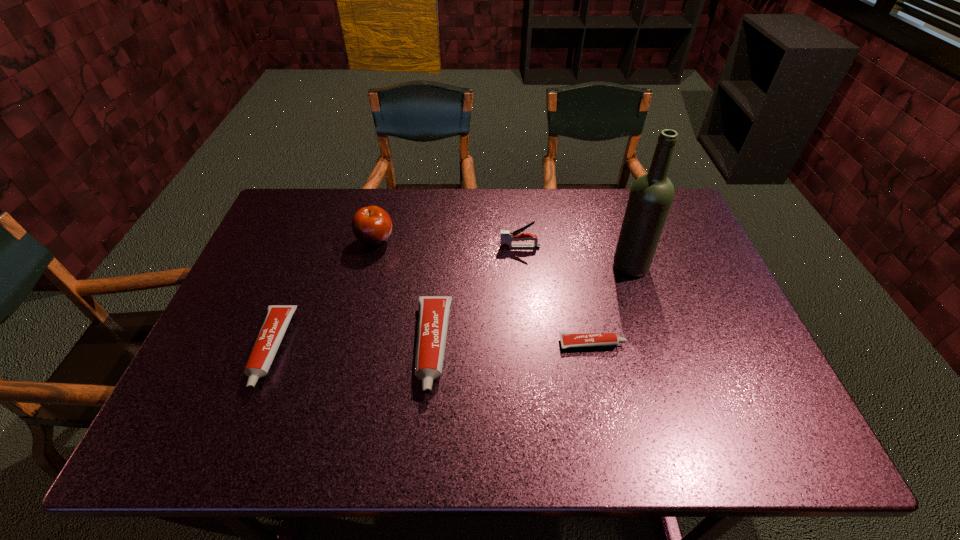
The width and height of the screenshot is (960, 540). Identify the location of the fifth tallest object. (277, 318).

You are a GUI agent. You are given a task and a screenshot of the screen. Output one action in this format:
    pyautogui.click(x=<x>, y=<y>)
    Task: Click on the second shortest toothpaste
    The width and height of the screenshot is (960, 540).
    Given the screenshot: What is the action you would take?
    pyautogui.click(x=277, y=318)

This screenshot has width=960, height=540. Find the location of `the second toothpaste from left to right`. the second toothpaste from left to right is located at coordinates (433, 316).

I want to click on the shortest toothpaste, so click(x=568, y=340).

Find the location of a particular element. The height and width of the screenshot is (540, 960). the second object from right to left is located at coordinates (568, 340).

Locate an element on the screen. This screenshot has height=540, width=960. the rightmost object is located at coordinates (651, 195).

Locate an element on the screen. The height and width of the screenshot is (540, 960). the tallest object is located at coordinates (651, 195).

Locate an element on the screen. This screenshot has width=960, height=540. stapler is located at coordinates (507, 237).

The width and height of the screenshot is (960, 540). I want to click on the fourth shortest object, so click(507, 237).

You are a GUI agent. You are given a task and a screenshot of the screen. Output one action in this format:
    pyautogui.click(x=<x>, y=<y>)
    Task: Click on the second object from left to right
    This screenshot has height=540, width=960.
    Given the screenshot: What is the action you would take?
    pyautogui.click(x=371, y=225)